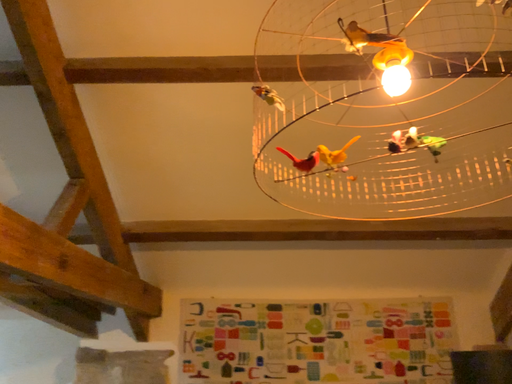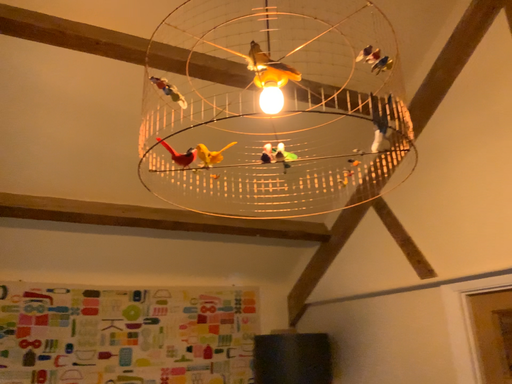
Question: How did the camera likely rotate when shooting the video?

Choices:
 (A) rotated right
 (B) rotated left

Answer: (A)